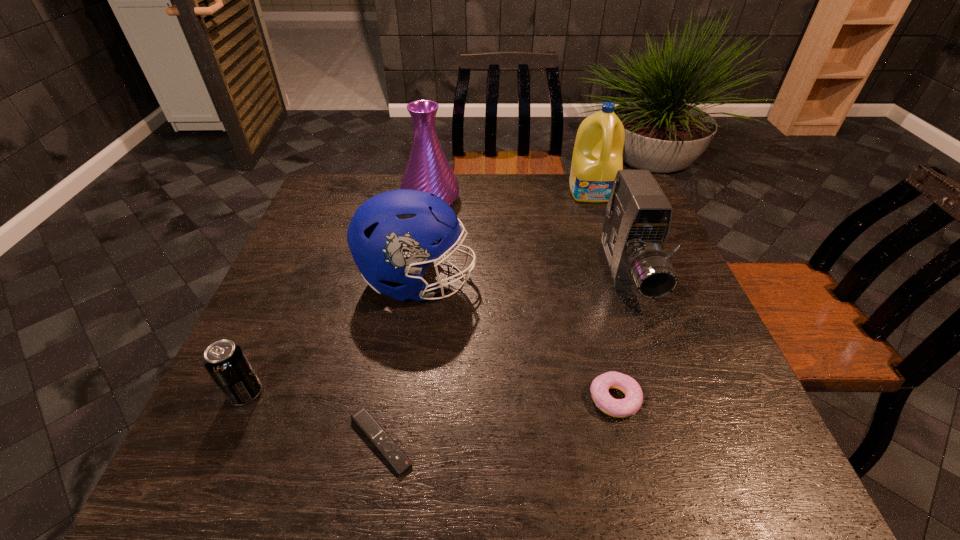
You are a GUI agent. You are given a task and a screenshot of the screen. Output one action in this format:
    pyautogui.click(x=<x>, y=<y>)
    Task: Click on the object that is at the far right corner
    This screenshot has height=540, width=960.
    Given the screenshot: What is the action you would take?
    pyautogui.click(x=597, y=156)

In the image, there is a desktop. At what (x,y) coordinates should I click in order to perform the action: click on blank space at the far edge. Please return your answer as a coordinate pair (x, y). Looking at the image, I should click on (570, 212).

Find the location of a particular element. vacant space at the left edge is located at coordinates (307, 267).

In the image, there is a desktop. Where is `vacant space at the right edge`? This screenshot has width=960, height=540. vacant space at the right edge is located at coordinates (713, 391).

Locate an element on the screen. The height and width of the screenshot is (540, 960). vacant space at the far right corner of the desktop is located at coordinates (598, 206).

Image resolution: width=960 pixels, height=540 pixels. I want to click on vacant region between the football helmet and the shortest object, so click(x=399, y=361).

You are a GUI agent. You are given a task and a screenshot of the screen. Output one action in this format:
    pyautogui.click(x=<x>, y=<y>)
    Task: Click on the free spot between the remote control and the football helmet
    
    Given the screenshot: What is the action you would take?
    pyautogui.click(x=399, y=361)

At what (x,y) coordinates should I click in order to perform the action: click on vacant area between the vase and the second shortest object. Please return your answer as a coordinate pair (x, y). This screenshot has width=960, height=540. Looking at the image, I should click on (523, 300).

What are the coordinates of `free space between the camcorder and the sixth tallest object` in the screenshot? It's located at (621, 337).

You are a GUI agent. You are given a task and a screenshot of the screen. Output one action in this format:
    pyautogui.click(x=<x>, y=<y>)
    Task: Click on the vacant area that lies between the shortest object and the second shortest object
    Image resolution: width=960 pixels, height=540 pixels.
    Given the screenshot: What is the action you would take?
    pyautogui.click(x=498, y=420)